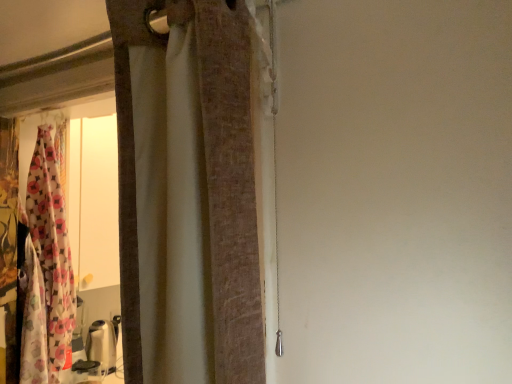
This screenshot has height=384, width=512. Describe the element at coordinates (230, 186) in the screenshot. I see `textured beige curtain at center, which is the first curtain from right to left` at that location.

The height and width of the screenshot is (384, 512). Identify the location of textured beige curtain at center, placed as the 2th curtain when sorted from back to front. (230, 186).

The image size is (512, 384). What do you see at coordinates (49, 258) in the screenshot? I see `floral fabric curtain at left, the 1th curtain viewed from the left` at bounding box center [49, 258].

What is the approximate height of floral fabric curtain at left, the 1th curtain viewed from the left?

It is 34.16 inches.

Identify the location of floral fabric curtain at left, the 1th curtain viewed from the left. (49, 258).

At what (x,y) coordinates should I click in order to perform the action: click on textured beige curtain at center, acting as the 2th curtain starting from the left. Please return your answer as a coordinate pair (x, y). The width and height of the screenshot is (512, 384). Looking at the image, I should click on (230, 186).

Considering the positions of objects textured beige curtain at center, which is counted as the first curtain, starting from the front, and floral fabric curtain at left, arranged as the first curtain when viewed from the back, in the image provided, who is more to the right, textured beige curtain at center, which is counted as the first curtain, starting from the front, or floral fabric curtain at left, arranged as the first curtain when viewed from the back,?

Positioned to the right is textured beige curtain at center, which is counted as the first curtain, starting from the front.

Between textured beige curtain at center, acting as the 2th curtain starting from the left, and floral fabric curtain at left, the 2th curtain in the front-to-back sequence, which one is positioned behind?

Positioned behind is floral fabric curtain at left, the 2th curtain in the front-to-back sequence.

Does point (217, 37) lie behind point (59, 286)?

No, (217, 37) is in front of (59, 286).

From the image's perspective, is textured beige curtain at center, which is the first curtain from right to left, positioned above or below floral fabric curtain at left, the 1th curtain viewed from the left?

Clearly, from the image's perspective, textured beige curtain at center, which is the first curtain from right to left, is above floral fabric curtain at left, the 1th curtain viewed from the left.

From a real-world perspective, is textured beige curtain at center, acting as the 2th curtain starting from the left, on floral fabric curtain at left, arranged as the first curtain when viewed from the back?

Correct, in the physical world, textured beige curtain at center, acting as the 2th curtain starting from the left, is higher than floral fabric curtain at left, arranged as the first curtain when viewed from the back.

Considering the sizes of objects textured beige curtain at center, which is the first curtain from right to left, and floral fabric curtain at left, the 1th curtain viewed from the left, in the image provided, who is wider, textured beige curtain at center, which is the first curtain from right to left, or floral fabric curtain at left, the 1th curtain viewed from the left,?

floral fabric curtain at left, the 1th curtain viewed from the left.

Between textured beige curtain at center, which is counted as the first curtain, starting from the front, and floral fabric curtain at left, the second curtain in the right-to-left sequence, which one has more height?

Standing taller between the two is floral fabric curtain at left, the second curtain in the right-to-left sequence.

Considering the relative sizes of textured beige curtain at center, which is the first curtain from right to left, and floral fabric curtain at left, the 1th curtain viewed from the left, in the image provided, is textured beige curtain at center, which is the first curtain from right to left, smaller than floral fabric curtain at left, the 1th curtain viewed from the left,?

Indeed, textured beige curtain at center, which is the first curtain from right to left, has a smaller size compared to floral fabric curtain at left, the 1th curtain viewed from the left.

Which is correct: textured beige curtain at center, which is the first curtain from right to left, is inside floral fabric curtain at left, the second curtain in the right-to-left sequence, or outside of it?

textured beige curtain at center, which is the first curtain from right to left, is not inside floral fabric curtain at left, the second curtain in the right-to-left sequence, it's outside.

Is textured beige curtain at center, which is counted as the first curtain, starting from the front, in contact with floral fabric curtain at left, the second curtain in the right-to-left sequence?

textured beige curtain at center, which is counted as the first curtain, starting from the front, and floral fabric curtain at left, the second curtain in the right-to-left sequence, are not in contact.

Is textured beige curtain at center, acting as the 2th curtain starting from the left, positioned with its back to floral fabric curtain at left, the 1th curtain viewed from the left?

textured beige curtain at center, acting as the 2th curtain starting from the left, is not turned away from floral fabric curtain at left, the 1th curtain viewed from the left.

How far apart are textured beige curtain at center, placed as the 2th curtain when sorted from back to front, and floral fabric curtain at left, the 2th curtain in the front-to-back sequence?

A distance of 32.87 inches exists between textured beige curtain at center, placed as the 2th curtain when sorted from back to front, and floral fabric curtain at left, the 2th curtain in the front-to-back sequence.

Identify the location of curtain located in front of the floral fabric curtain at left, the 1th curtain viewed from the left. Image resolution: width=512 pixels, height=384 pixels. (230, 186).

Between floral fabric curtain at left, the 1th curtain viewed from the left, and textured beige curtain at center, acting as the 2th curtain starting from the left, which one appears on the right side from the viewer's perspective?

Positioned to the right is textured beige curtain at center, acting as the 2th curtain starting from the left.

From the picture: In the image, is floral fabric curtain at left, arranged as the first curtain when viewed from the back, positioned in front of or behind textured beige curtain at center, which is the first curtain from right to left?

Visually, floral fabric curtain at left, arranged as the first curtain when viewed from the back, is located behind textured beige curtain at center, which is the first curtain from right to left.

Considering the points (42, 129) and (253, 290), which point is behind, point (42, 129) or point (253, 290)?

The point (42, 129) is behind.

In the scene shown: From the image's perspective, is floral fabric curtain at left, the 1th curtain viewed from the left, above or below textured beige curtain at center, which is counted as the first curtain, starting from the front?

floral fabric curtain at left, the 1th curtain viewed from the left, is below textured beige curtain at center, which is counted as the first curtain, starting from the front.

From a real-world perspective, who is located higher, floral fabric curtain at left, arranged as the first curtain when viewed from the back, or textured beige curtain at center, acting as the 2th curtain starting from the left?

textured beige curtain at center, acting as the 2th curtain starting from the left, from a real-world perspective.

Is floral fabric curtain at left, arranged as the first curtain when viewed from the back, wider than textured beige curtain at center, placed as the 2th curtain when sorted from back to front?

Yes, floral fabric curtain at left, arranged as the first curtain when viewed from the back, is wider than textured beige curtain at center, placed as the 2th curtain when sorted from back to front.

Is floral fabric curtain at left, the 1th curtain viewed from the left, shorter than textured beige curtain at center, placed as the 2th curtain when sorted from back to front?

No, floral fabric curtain at left, the 1th curtain viewed from the left, is not shorter than textured beige curtain at center, placed as the 2th curtain when sorted from back to front.

Can you confirm if floral fabric curtain at left, the second curtain in the right-to-left sequence, is bigger than textured beige curtain at center, which is counted as the first curtain, starting from the front?

Yes.

Is floral fabric curtain at left, the second curtain in the right-to-left sequence, completely or partially outside of textured beige curtain at center, which is the first curtain from right to left?

Absolutely, floral fabric curtain at left, the second curtain in the right-to-left sequence, is external to textured beige curtain at center, which is the first curtain from right to left.

Is floral fabric curtain at left, the 1th curtain viewed from the left, not close to textured beige curtain at center, which is counted as the first curtain, starting from the front?

That's not correct — floral fabric curtain at left, the 1th curtain viewed from the left, is a little close to textured beige curtain at center, which is counted as the first curtain, starting from the front.

Is floral fabric curtain at left, the 2th curtain in the front-to-back sequence, facing towards textured beige curtain at center, placed as the 2th curtain when sorted from back to front?

No.

The width and height of the screenshot is (512, 384). Identify the location of curtain behind the textured beige curtain at center, which is the first curtain from right to left. (49, 258).

Locate an element on the screen. The image size is (512, 384). curtain lying in front of the floral fabric curtain at left, the 2th curtain in the front-to-back sequence is located at coordinates click(230, 186).

I want to click on curtain lying above the floral fabric curtain at left, the second curtain in the right-to-left sequence (from the image's perspective), so click(230, 186).